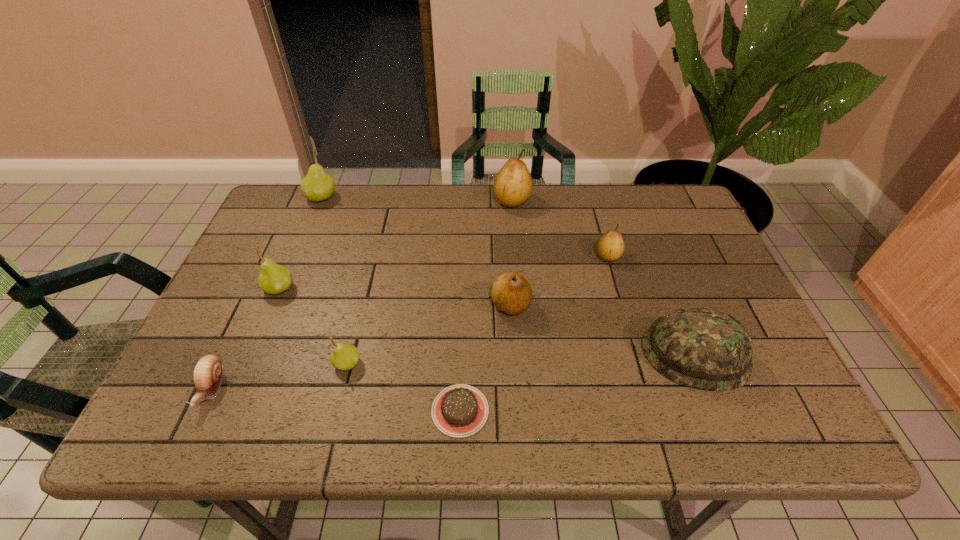
Image resolution: width=960 pixels, height=540 pixels. Identify the location of vacant area between the second smallest brown pear and the biggest brown pear. (512, 253).

Identify which object is the sixth nearest to the seventh nearest object. Please provide its 2D coordinates. Your answer should be formatted as a tuple, i.e. [(x, y)], where the tuple contains the x and y coordinates of a point satisfying the conditions above.

[(273, 279)]

At what (x,y) coordinates should I click in order to perform the action: click on object that can be found as the sixth closest to the nearest brown pear. Please return your answer as a coordinate pair (x, y). Looking at the image, I should click on (273, 279).

Locate an element on the screen. This screenshot has height=540, width=960. pear that is the second closest to the nearest green pear is located at coordinates (511, 293).

Find the location of a particular element. Image resolution: width=960 pixels, height=540 pixels. the fourth closest pear to the chocolate cake is located at coordinates (610, 246).

Choose which brown pear is the second nearest neighbor to the second farthest green pear. Please provide its 2D coordinates. Your answer should be formatted as a tuple, i.e. [(x, y)], where the tuple contains the x and y coordinates of a point satisfying the conditions above.

[(513, 184)]

Identify which brown pear is the closest to the farthest green pear. Please provide its 2D coordinates. Your answer should be formatted as a tuple, i.e. [(x, y)], where the tuple contains the x and y coordinates of a point satisfying the conditions above.

[(513, 184)]

Locate which green pear is the third closest to the smallest brown pear. Please provide its 2D coordinates. Your answer should be formatted as a tuple, i.e. [(x, y)], where the tuple contains the x and y coordinates of a point satisfying the conditions above.

[(317, 185)]

Identify which green pear is located as the third nearest to the nearest brown pear. Please provide its 2D coordinates. Your answer should be formatted as a tuple, i.e. [(x, y)], where the tuple contains the x and y coordinates of a point satisfying the conditions above.

[(317, 185)]

Locate an element on the screen. The height and width of the screenshot is (540, 960). free space that satisfies the following two spatial constraints: 1. on the front-facing side of the eighth tallest object; 2. on the left side of the shortest object is located at coordinates (202, 410).